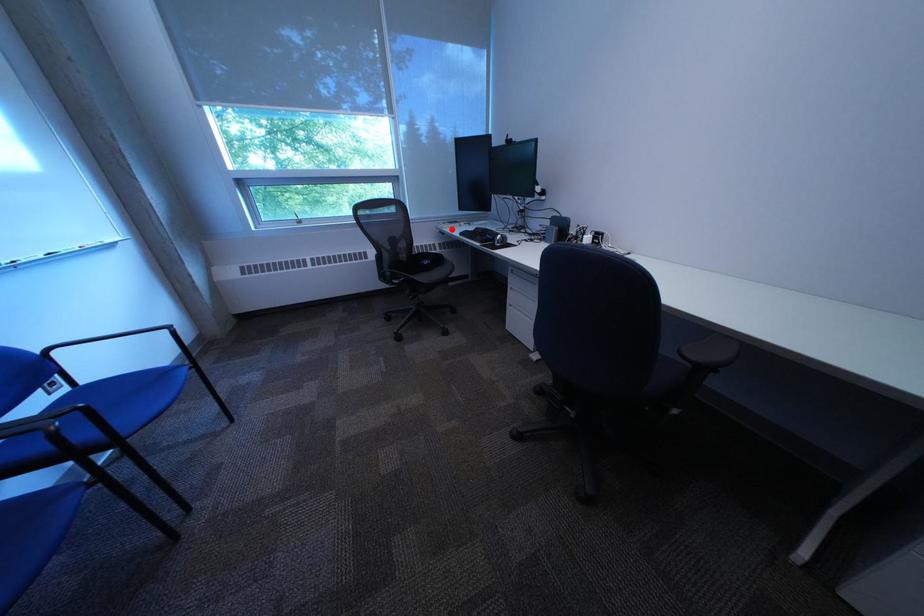
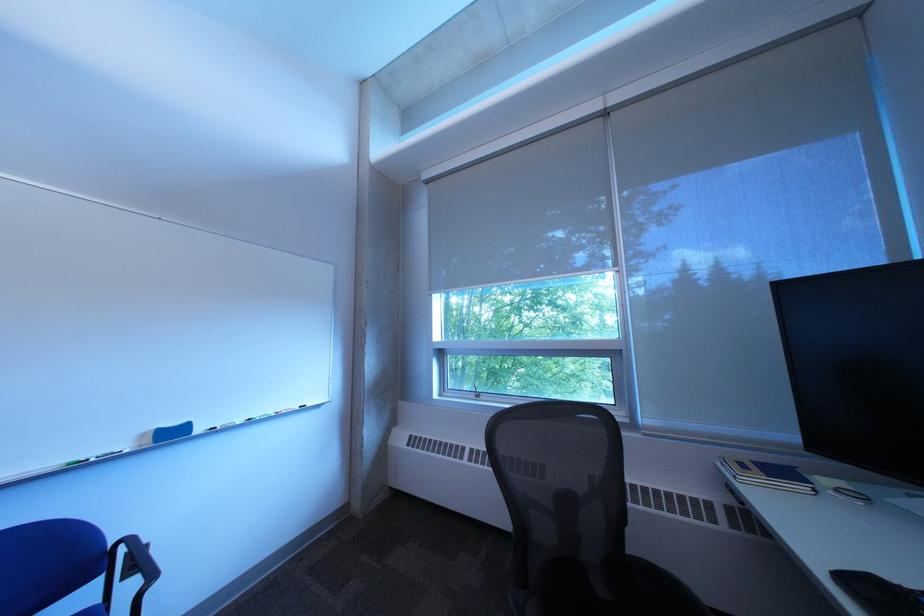
Question: I am providing you with two images of the same scene from different viewpoints. Image1 has a red point marked. In image2, the corresponding 3D location appears at what relative position? Reply with the corresponding letter.

Choices:
 (A) Closer
 (B) Farther

Answer: (B)